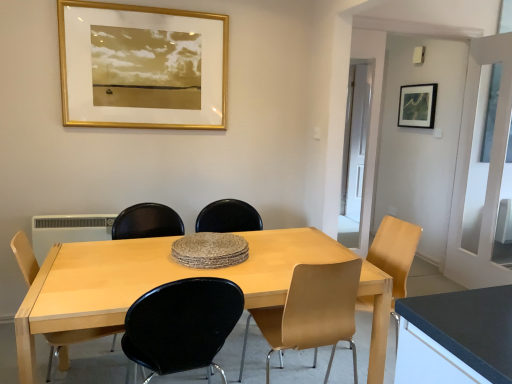
Question: Considering their positions, is light wood table at center located in front of or behind gold/gilded picture frame at upper center, acting as the 2th picture frame starting from the back?

Choices:
 (A) front
 (B) behind

Answer: (A)

Question: From the image's perspective, is light wood table at center above or below gold/gilded picture frame at upper center, the second picture frame when ordered from right to left?

Choices:
 (A) above
 (B) below

Answer: (B)

Question: Based on their relative distances, which object is nearer to the matte yellow chair at right, the 1th chair in the right-to-left sequence?

Choices:
 (A) light brown wood chair at center, marked as the third chair in a left-to-right arrangement
 (B) matte black chair at center, which appears as the first armchair when viewed from the right
 (C) light brown wood chair at lower left, which appears as the 1th chair when viewed from the left
 (D) gold/gilded picture frame at upper center, the second picture frame when ordered from right to left
 (E) light wood table at center

Answer: (A)

Question: Based on their relative distances, which object is farther from the matte black picture frame at upper right, the second picture frame when ordered from left to right?

Choices:
 (A) matte yellow chair at right, the fourth chair positioned from the left
 (B) white plastic radiator at lower left
 (C) white glossy door at center
 (D) gold/gilded picture frame at upper center, which is the first picture frame in front-to-back order
 (E) light wood table at center

Answer: (B)